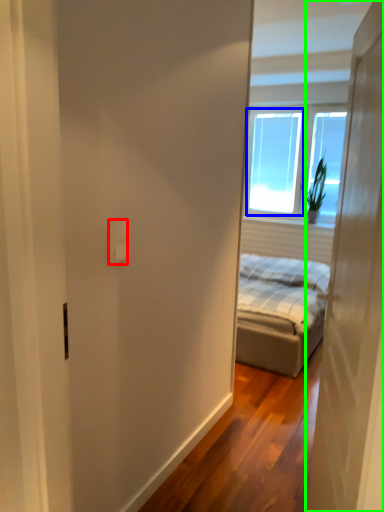
Question: Which object is the closest to the electric outlet (highlighted by a red box)? Choose among these: window screen (highlighted by a blue box) or door (highlighted by a green box).

Choices:
 (A) window screen
 (B) door

Answer: (B)